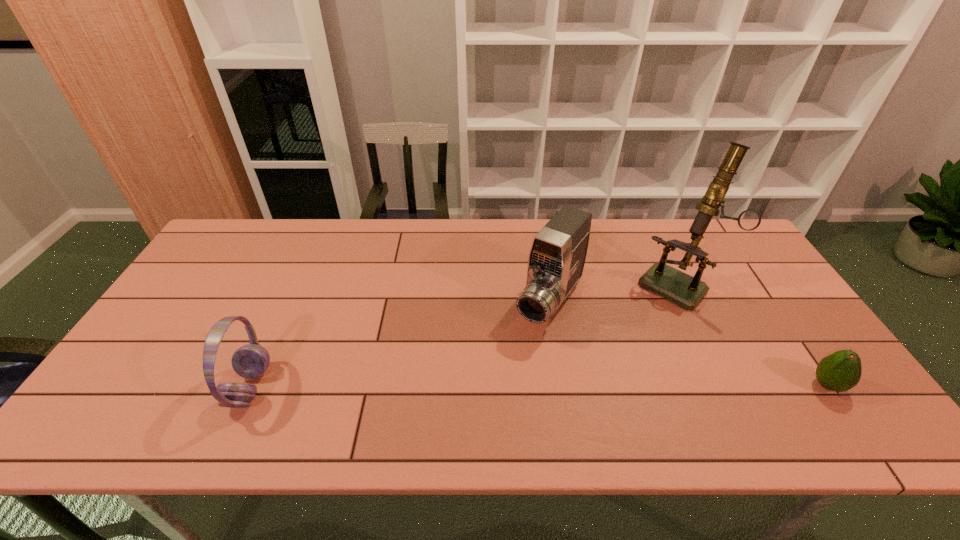
In order to click on free space on the desktop that is between the leftmost object and the avocado and is positioned at the eyepiece of the microscope in this screenshot , I will do `click(585, 386)`.

Locate an element on the screen. vacant space on the desktop that is between the leftmost object and the avocado and is positioned at the front of the third shortest object, highlighting the lens is located at coordinates (488, 387).